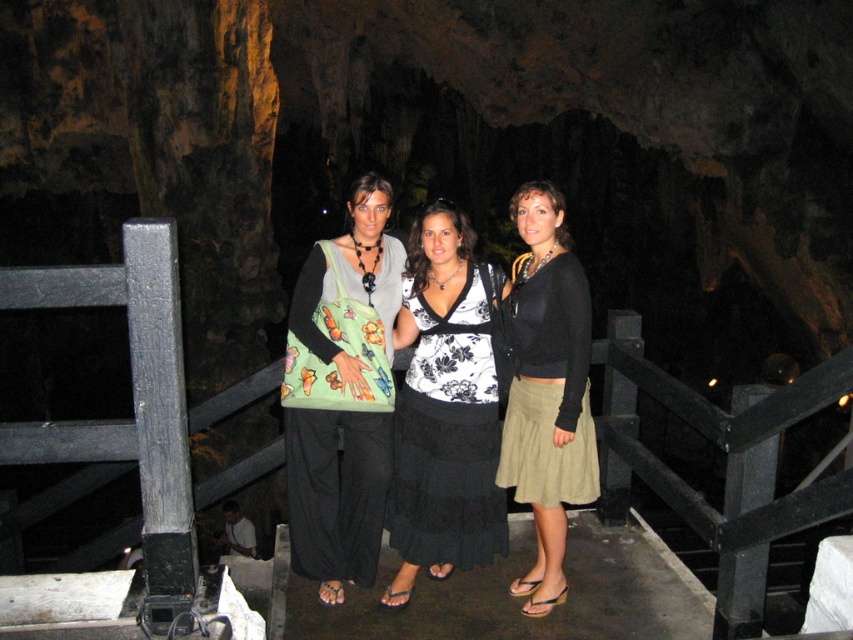
Which of these two, black floral dress at center or olive-green skirt at center, stands taller?

Standing taller between the two is olive-green skirt at center.

Is black floral dress at center taller than olive-green skirt at center?

In fact, black floral dress at center may be shorter than olive-green skirt at center.

Between point (479, 406) and point (566, 394), which one is positioned behind?

Point (479, 406)

The width and height of the screenshot is (853, 640). I want to click on black floral dress at center, so 445,406.

Between green fabric bag at center and black floral dress at center, which one is positioned higher?

green fabric bag at center

Does green fabric bag at center appear on the right side of black floral dress at center?

Incorrect, green fabric bag at center is not on the right side of black floral dress at center.

Between point (392, 349) and point (410, 477), which one is positioned behind?

The point (410, 477) is more distant.

Where is `green fabric bag at center`? green fabric bag at center is located at coordinates (341, 394).

Looking at this image, can you confirm if green fabric bag at center is thinner than olive-green skirt at center?

No.

Between green fabric bag at center and olive-green skirt at center, which one is positioned higher?

green fabric bag at center is higher up.

Is point (361, 234) more distant than point (566, 470)?

Yes, it is behind point (566, 470).

Find the location of a particular element. Image resolution: width=853 pixels, height=640 pixels. green fabric bag at center is located at coordinates (341, 394).